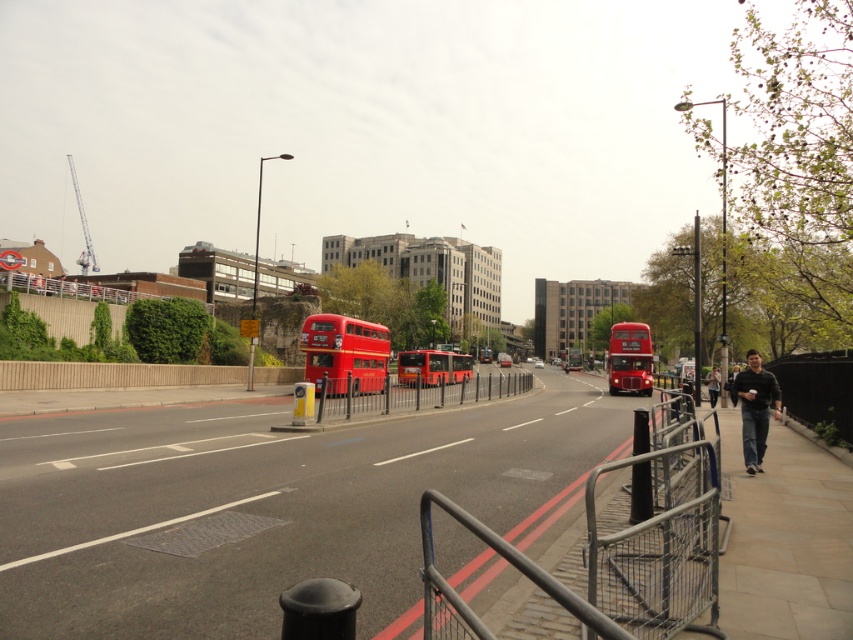
Question: Considering the relative positions of concrete pavement at center and dark gray sweater at right in the image provided, where is concrete pavement at center located with respect to dark gray sweater at right?

Choices:
 (A) below
 (B) above

Answer: (B)

Question: Which point is closer to the camera?

Choices:
 (A) (712, 401)
 (B) (372, 372)
 (C) (514, 381)
 (D) (218, 502)

Answer: (D)

Question: Is metallic silver rail at center behind matte red double-decker bus at center?

Choices:
 (A) yes
 (B) no

Answer: (B)

Question: Which point is closer to the camera taking this photo?

Choices:
 (A) (712, 368)
 (B) (370, 372)

Answer: (B)

Question: Is matte red double-decker bus at center-left smaller than dark gray sweater at right?

Choices:
 (A) no
 (B) yes

Answer: (A)

Question: Estimate the real-world distances between objects in this image. Which object is closer to the concrete pavement at center?

Choices:
 (A) metallic gray rail at center
 (B) matte red bus at center
 (C) dark gray jeans at right
 (D) matte red double-decker bus at center

Answer: (C)